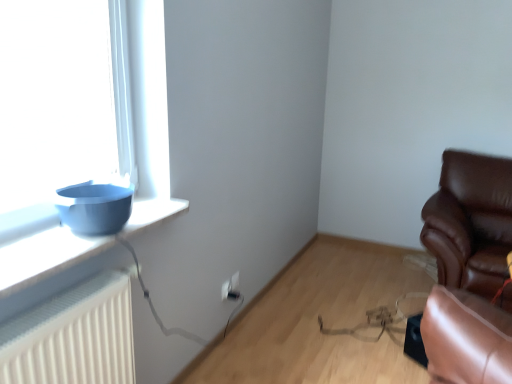
Question: Considering their positions, is brown leather chair at right located in front of or behind matte blue bowl at left?

Choices:
 (A) behind
 (B) front

Answer: (A)

Question: From the image's perspective, relative to matte blue bowl at left, is brown leather chair at right above or below?

Choices:
 (A) below
 (B) above

Answer: (A)

Question: Based on their relative distances, which object is farther from the white plastic electric outlet at lower center?

Choices:
 (A) matte blue bowl at left
 (B) brown leather chair at right

Answer: (B)

Question: Which object is positioned farthest from the white plastic electric outlet at lower center?

Choices:
 (A) brown leather chair at right
 (B) matte blue bowl at left

Answer: (A)